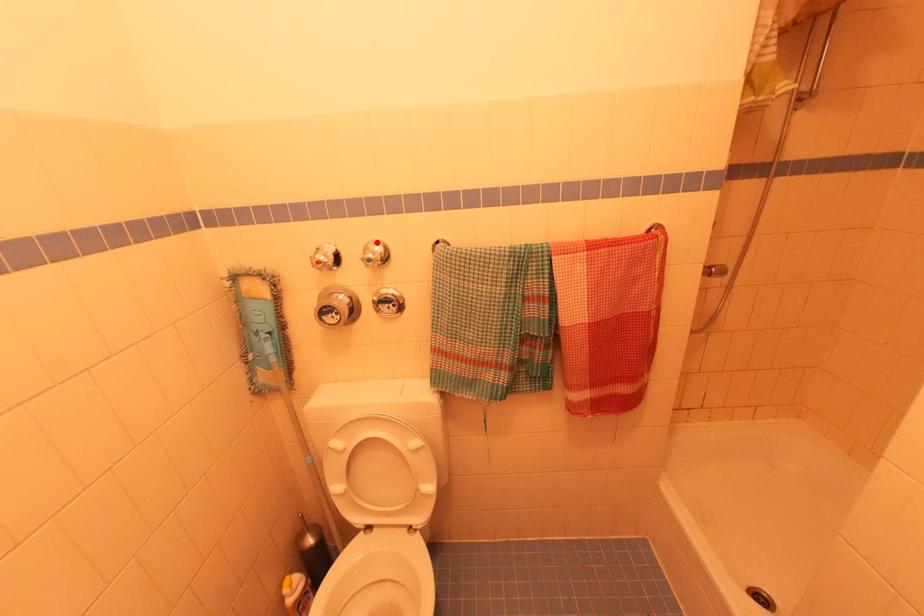
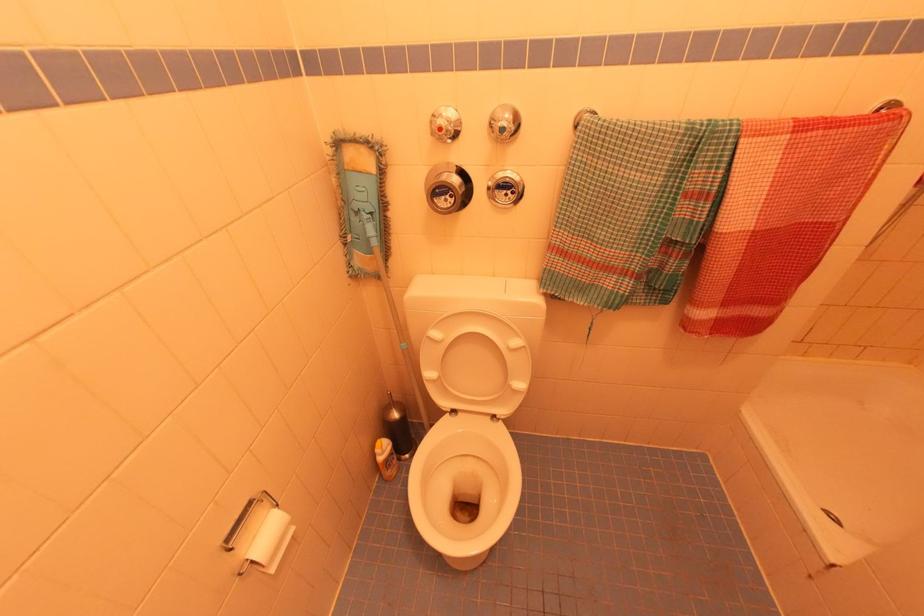
Find the pixel in the second image that matches the highlighted location in the first image.

(505, 108)